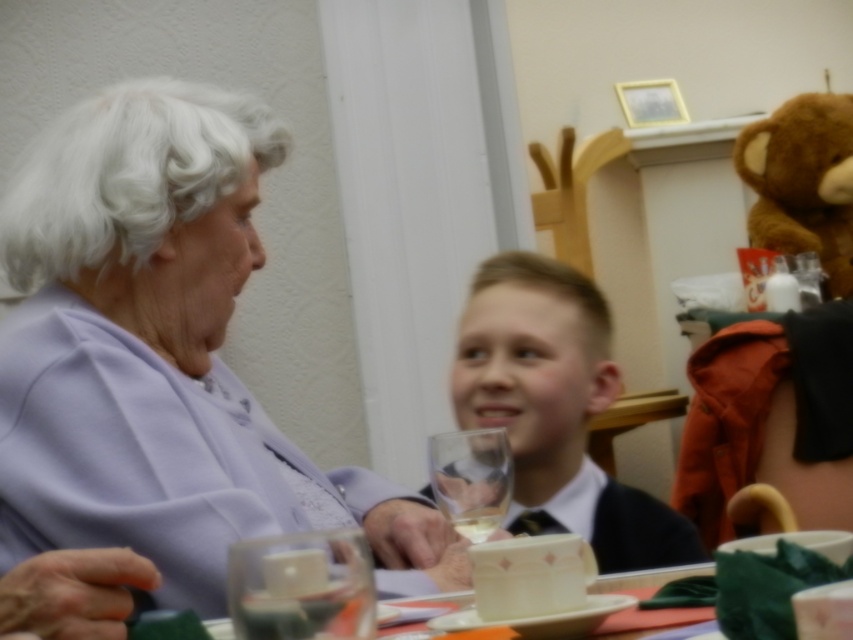
Does transparent glass at lower center have a greater width compared to clear glass wine glass at lower center?

Incorrect, transparent glass at lower center's width does not surpass clear glass wine glass at lower center's.

Is point (264, 561) positioned after point (463, 486)?

No, it is in front of (463, 486).

Does point (289, 624) come behind point (490, 525)?

No, it is in front of (490, 525).

Find the location of a particular element. This screenshot has width=853, height=640. transparent glass at lower center is located at coordinates (302, 586).

Between point (463, 499) and point (473, 522), which one is positioned behind?

Positioned behind is point (473, 522).

Describe the element at coordinates (471, 477) in the screenshot. This screenshot has width=853, height=640. I see `clear glass wine glass at lower center` at that location.

The image size is (853, 640). I want to click on clear glass wine glass at lower center, so pos(471,477).

Which is in front, point (494, 332) or point (471, 497)?

Positioned in front is point (471, 497).

Can you confirm if matte black tie at center is positioned above clear glass wine glass at lower center?

Correct, matte black tie at center is located above clear glass wine glass at lower center.

Which is behind, point (508, 433) or point (482, 436)?

Point (508, 433)

I want to click on matte black tie at center, so click(556, 410).